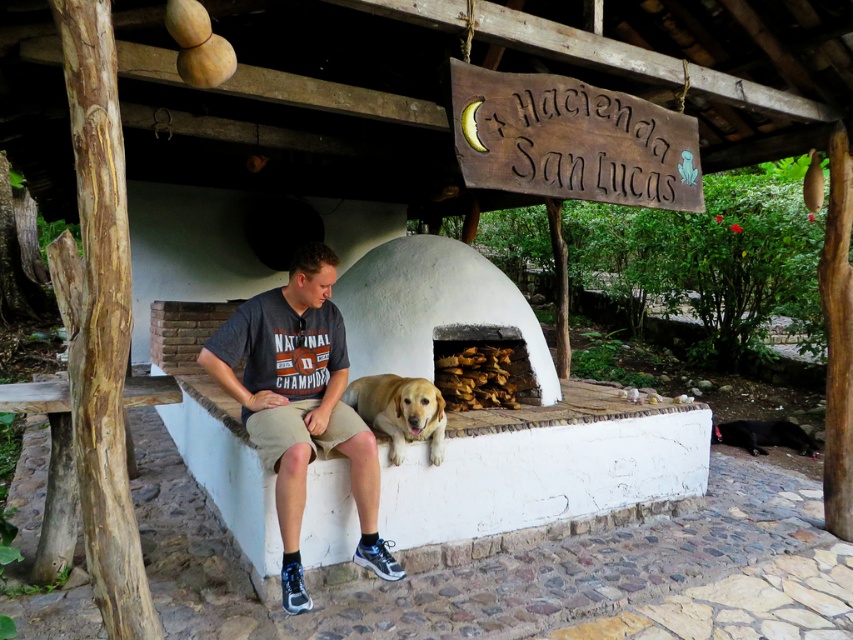
You are a photographer standing in front of the dome oven. You see the golden fur dog at center and the black fur dog at lower right. Which dog is taller?

The golden fur dog at center is taller than the black fur dog at lower right.